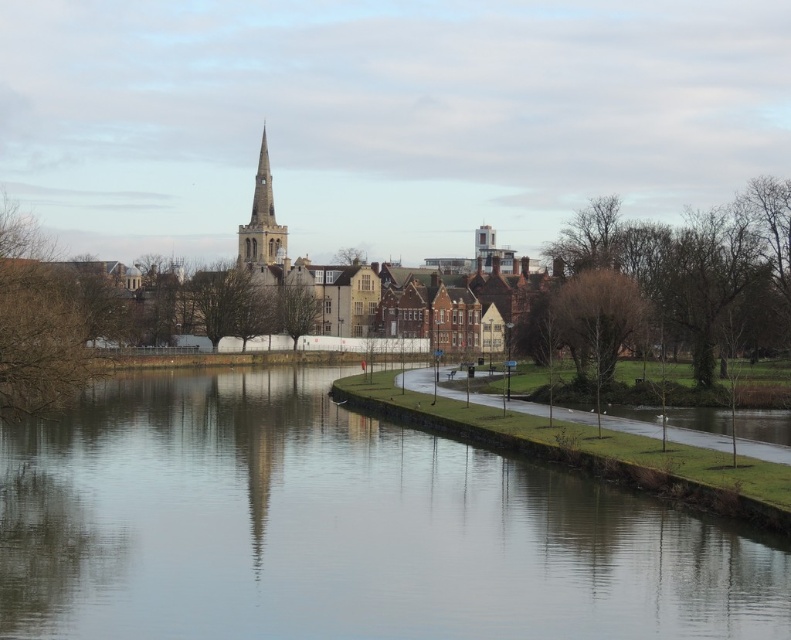
Question: Which object is farther from the camera taking this photo?

Choices:
 (A) smooth stone church at center
 (B) smooth stone spire at upper center

Answer: (B)

Question: Based on their relative distances, which object is farther from the bare brown tree at right?

Choices:
 (A) smooth stone church at center
 (B) bare wood trees at right
 (C) green leafy tree at center
 (D) brown leafless tree at left

Answer: (C)

Question: Is smooth stone church at center to the right of brown leafless tree at left from the viewer's perspective?

Choices:
 (A) yes
 (B) no

Answer: (A)

Question: Does brown leafless tree at left appear on the left side of smooth stone spire at upper center?

Choices:
 (A) no
 (B) yes

Answer: (B)

Question: Considering the real-world distances, which object is closest to the bare brown tree at right?

Choices:
 (A) brown leafless tree at left
 (B) smooth stone church at center
 (C) green leafy tree at center
 (D) smooth stone spire at upper center

Answer: (B)

Question: Is smooth water at center smaller than smooth stone church at center?

Choices:
 (A) no
 (B) yes

Answer: (B)